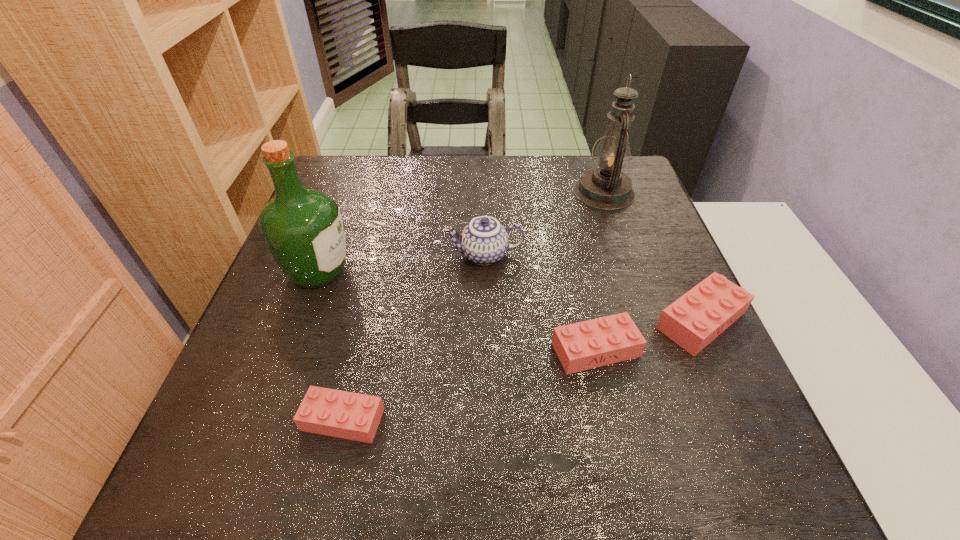
Locate an element on the screen. liquor present at the left edge is located at coordinates (303, 229).

Identify the location of oil lamp located in the right edge section of the desktop. (606, 187).

The image size is (960, 540). I want to click on object at the near left corner, so click(x=342, y=414).

Locate an element on the screen. This screenshot has height=540, width=960. object at the far right corner is located at coordinates (606, 187).

Where is `blank area at the far edge`? blank area at the far edge is located at coordinates (430, 187).

The height and width of the screenshot is (540, 960). Find the location of `vacant space at the near edge of the desktop`. vacant space at the near edge of the desktop is located at coordinates (605, 433).

Where is `vacant space at the left edge of the desktop`? vacant space at the left edge of the desktop is located at coordinates (265, 370).

The height and width of the screenshot is (540, 960). I want to click on vacant space at the right edge, so click(x=716, y=380).

This screenshot has width=960, height=540. Find the location of `vacant region at the far left corner of the desktop`. vacant region at the far left corner of the desktop is located at coordinates (373, 172).

Locate an element on the screen. vacant region at the near left corner of the desktop is located at coordinates (223, 426).